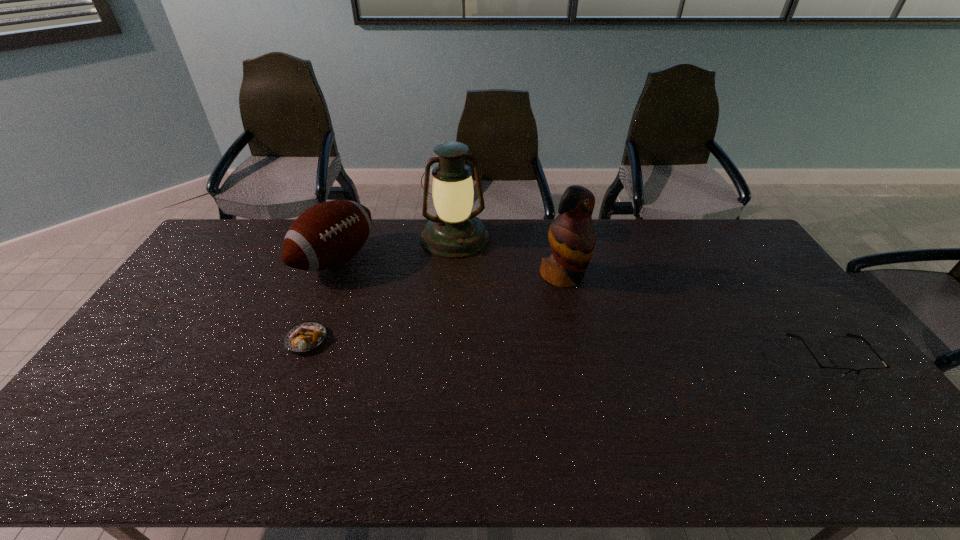
This screenshot has height=540, width=960. What are the coordinates of `free space on the desktop that is between the pastry and the rightmost object and is positioned on the laces of the third shortest object` in the screenshot? It's located at (497, 346).

Locate an element on the screen. The width and height of the screenshot is (960, 540). free spot on the desktop that is between the pastry and the spectacles and is positioned on the face of the parrot is located at coordinates (636, 350).

At what (x,y) coordinates should I click in order to perform the action: click on vacant spot on the desktop that is between the pastry and the rightmost object and is positioned with the light compartment facing forward on the lantern. Please return your answer as a coordinate pair (x, y). Looking at the image, I should click on (489, 346).